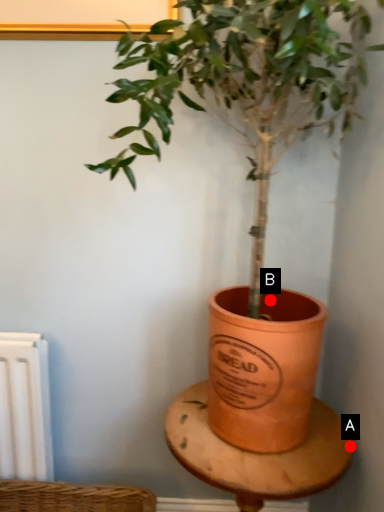
Question: Two points are circled on the image, labeled by A and B beside each circle. Which point appears closest to the camera in this image?

Choices:
 (A) A is closer
 (B) B is closer

Answer: (A)